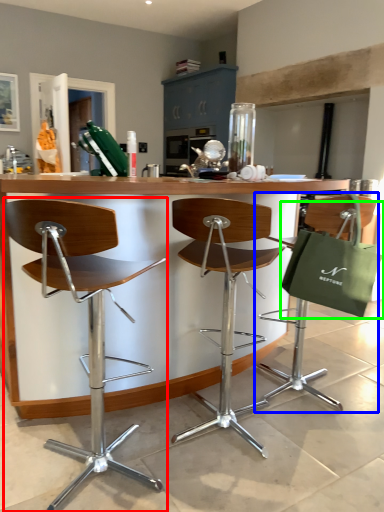
Question: Based on their relative distances, which object is farther from chair (highlighted by a red box)? Choose from chair (highlighted by a blue box) and shopping bag (highlighted by a green box).

Choices:
 (A) chair
 (B) shopping bag

Answer: (A)